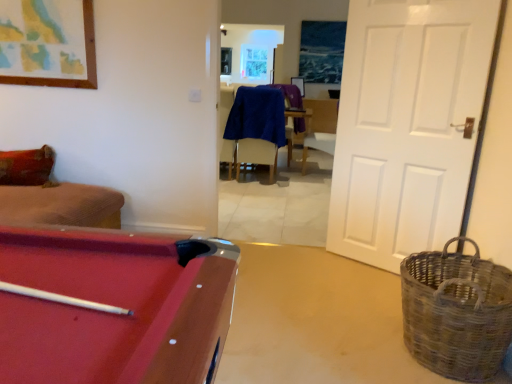
This screenshot has height=384, width=512. What do you see at coordinates (257, 127) in the screenshot?
I see `blue fabric chair at center` at bounding box center [257, 127].

The width and height of the screenshot is (512, 384). What are the coordinates of `blue fabric chair at center` in the screenshot? It's located at (257, 127).

Locate an element on the screen. blue fabric armchair at center is located at coordinates (290, 95).

I want to click on rubberized red pool table at lower left, so click(196, 313).

Describe the element at coordinates (456, 312) in the screenshot. Image resolution: width=512 pixels, height=384 pixels. I see `rustic woven basket at right` at that location.

Find the location of a particular element. The width and height of the screenshot is (512, 384). blue fabric chair at center is located at coordinates (257, 127).

Is point (448, 273) in front of point (21, 314)?

No.

Is rustic woven basket at right oriented away from rubberized red pool table at lower left?

No, rubberized red pool table at lower left is not at the back of rustic woven basket at right.

Are rustic woven basket at right and rubberized red pool table at lower left located far from each other?

No, rustic woven basket at right is not far from rubberized red pool table at lower left.

Is rustic woven basket at right thinner than rubberized red pool table at lower left?

Yes, rustic woven basket at right is thinner than rubberized red pool table at lower left.

Does point (277, 114) lie in front of point (435, 305)?

No, (277, 114) is further to viewer.

Consider the image. From a real-world perspective, is blue fabric chair at center physically below rustic woven basket at right?

Incorrect, from a real-world perspective, blue fabric chair at center is higher than rustic woven basket at right.

Considering the relative positions of blue fabric chair at center and rustic woven basket at right in the image provided, is blue fabric chair at center to the right of rustic woven basket at right from the viewer's perspective?

Incorrect, blue fabric chair at center is not on the right side of rustic woven basket at right.

Considering the sizes of objects blue fabric chair at center and rustic woven basket at right in the image provided, who is wider, blue fabric chair at center or rustic woven basket at right?

With larger width is rustic woven basket at right.

Consider the image. Is white matte door at right at the right side of blue fabric armchair at center?

Indeed, white matte door at right is positioned on the right side of blue fabric armchair at center.

Considering the sizes of objects white matte door at right and blue fabric armchair at center in the image provided, who is bigger, white matte door at right or blue fabric armchair at center?

blue fabric armchair at center is bigger.

Is white matte door at right thinner than blue fabric armchair at center?

Correct, the width of white matte door at right is less than that of blue fabric armchair at center.

Can you see white matte door at right touching blue fabric armchair at center?

No.

Looking at this image, considering the sizes of objects rustic woven basket at right and white matte door at right in the image provided, who is smaller, rustic woven basket at right or white matte door at right?

Smaller between the two is rustic woven basket at right.

From a real-world perspective, is rustic woven basket at right above or below white matte door at right?

rustic woven basket at right is below white matte door at right.

Locate an element on the screen. The image size is (512, 384). door that is behind the rustic woven basket at right is located at coordinates (408, 125).

From the image's perspective, is rustic woven basket at right on white matte door at right?

No.

From the image's perspective, which one is positioned higher, white matte door at right or rustic woven basket at right?

white matte door at right is shown above in the image.

From a real-world perspective, relative to rustic woven basket at right, is white matte door at right vertically above or below?

In terms of real-world spatial position, white matte door at right is above rustic woven basket at right.

Could you tell me if white matte door at right is facing rustic woven basket at right?

Yes, white matte door at right is facing rustic woven basket at right.

Is white matte door at right behind rustic woven basket at right?

Yes, the depth of white matte door at right is greater than that of rustic woven basket at right.

Considering the sizes of objects blue fabric chair at center and rubberized red pool table at lower left in the image provided, who is thinner, blue fabric chair at center or rubberized red pool table at lower left?

blue fabric chair at center.

Is blue fabric chair at center aimed at rubberized red pool table at lower left?

No, blue fabric chair at center is not facing towards rubberized red pool table at lower left.

From a real-world perspective, between blue fabric chair at center and rubberized red pool table at lower left, who is vertically higher?

From a 3D spatial view, blue fabric chair at center is above.

Is blue fabric chair at center positioned beyond the bounds of blue fabric armchair at center?

blue fabric chair at center lies outside blue fabric armchair at center's area.

Is blue fabric chair at center thinner than blue fabric armchair at center?

Correct, the width of blue fabric chair at center is less than that of blue fabric armchair at center.

Looking at this image, from a real-world perspective, is blue fabric chair at center above or below blue fabric armchair at center?

Clearly, from a real-world perspective, blue fabric chair at center is below blue fabric armchair at center.

Is blue fabric chair at center to the right of blue fabric armchair at center from the viewer's perspective?

Incorrect, blue fabric chair at center is not on the right side of blue fabric armchair at center.

You are a GUI agent. You are given a task and a screenshot of the screen. Output one action in this format:
    pyautogui.click(x=<x>, y=<y>)
    Task: Click on the table in front of the rustic woven basket at right
    Image resolution: width=512 pixels, height=384 pixels.
    Given the screenshot: What is the action you would take?
    pyautogui.click(x=196, y=313)

In order to click on chair located above the rustic woven basket at right (from a real-world perspective) in this screenshot , I will do tap(257, 127).

Estimate the real-world distances between objects in this image. Which object is closer to rustic woven basket at right, white matte door at right or blue fabric chair at center?

Based on the image, white matte door at right appears to be nearer to rustic woven basket at right.

Which object lies nearer to the anchor point rubberized red pool table at lower left, blue fabric chair at center or blue fabric armchair at center?

blue fabric chair at center is positioned closer to the anchor rubberized red pool table at lower left.

Looking at the image, which one is located closer to white matte door at right, blue fabric chair at center or rubberized red pool table at lower left?

rubberized red pool table at lower left lies closer to white matte door at right than the other object.

Estimate the real-world distances between objects in this image. Which object is closer to rubberized red pool table at lower left, rustic woven basket at right or white matte door at right?

rustic woven basket at right is closer to rubberized red pool table at lower left.

Estimate the real-world distances between objects in this image. Which object is closer to blue fabric chair at center, rubberized red pool table at lower left or rustic woven basket at right?

Based on the image, rubberized red pool table at lower left appears to be nearer to blue fabric chair at center.

When comparing their distances from blue fabric armchair at center, does blue fabric chair at center or rubberized red pool table at lower left seem closer?

Among the two, blue fabric chair at center is located nearer to blue fabric armchair at center.

Looking at the image, which one is located closer to rustic woven basket at right, rubberized red pool table at lower left or white matte door at right?

rubberized red pool table at lower left lies closer to rustic woven basket at right than the other object.

From the image, which object appears to be farther from blue fabric chair at center, white matte door at right or blue fabric armchair at center?

Among the two, white matte door at right is located further to blue fabric chair at center.

Image resolution: width=512 pixels, height=384 pixels. Find the location of `basket between white matte door at right and rubberized red pool table at lower left in the vertical direction`. basket between white matte door at right and rubberized red pool table at lower left in the vertical direction is located at coordinates (456, 312).

At what (x,y) coordinates should I click in order to perform the action: click on door located between rustic woven basket at right and blue fabric armchair at center in the depth direction. Please return your answer as a coordinate pair (x, y). Looking at the image, I should click on 408,125.

At what (x,y) coordinates should I click in order to perform the action: click on door located between rustic woven basket at right and blue fabric chair at center in the depth direction. Please return your answer as a coordinate pair (x, y). This screenshot has width=512, height=384. Looking at the image, I should click on [408, 125].

Image resolution: width=512 pixels, height=384 pixels. I want to click on basket between rubberized red pool table at lower left and blue fabric armchair at center in the front-back direction, so click(x=456, y=312).